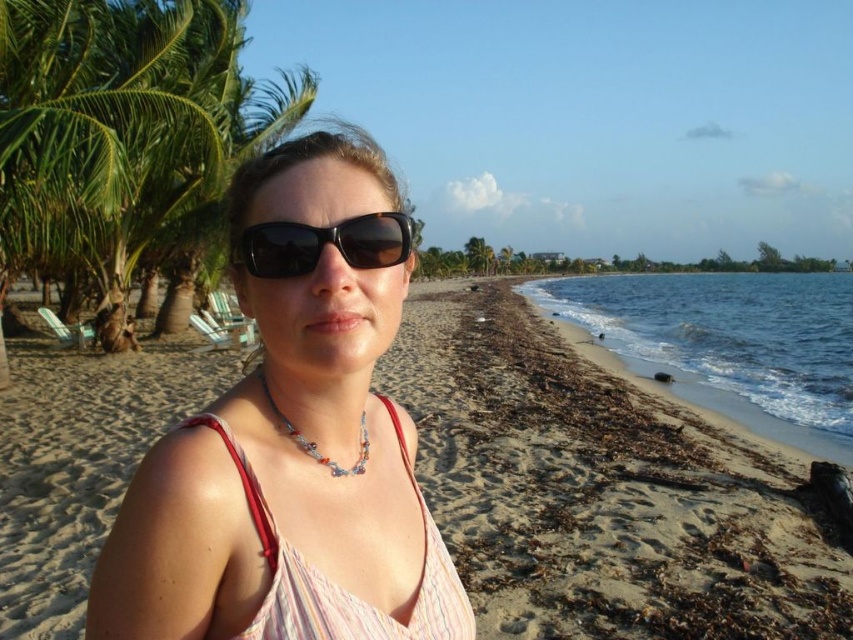
Based on the photo, you are standing on the beach and want to reach the point marked at coordinates (322, 605). If your height is 65 inches, will you be able to see the point from your current position?

The point marked at coordinates (322, 605) is 39.19 inches away from the viewer. Since this distance is less than your height of 65 inches, you should be able to see the point from your current position.

You are a photographer standing at the point marked as point (370,637). You want to take a photo of the beach scene. If you move backward towards point (294,433), will the palm trees in the background become more visible in your photo?

Yes, moving backward towards point (294,433) will bring the palm trees in the background into a more visible position in your photo because point (370,637) is in front of point (294,433), meaning moving towards the latter from the former increases the distance from the foreground and allows the background elements like palm trees to become more prominent.

You are a photographer trying to capture the model in this beach scene. You want to ensure the pink fabric bikini top at center and the multicolored beaded necklace at center are both visible in the shot. Which one is positioned lower on the model?

The pink fabric bikini top at center is positioned lower than the multicolored beaded necklace at center.